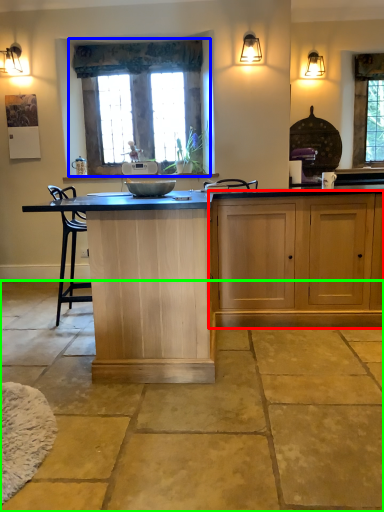
Question: Estimate the real-world distances between objects in this image. Which object is farther from cabinetry (highlighted by a red box), window (highlighted by a blue box) or concrete (highlighted by a green box)?

Choices:
 (A) window
 (B) concrete

Answer: (A)